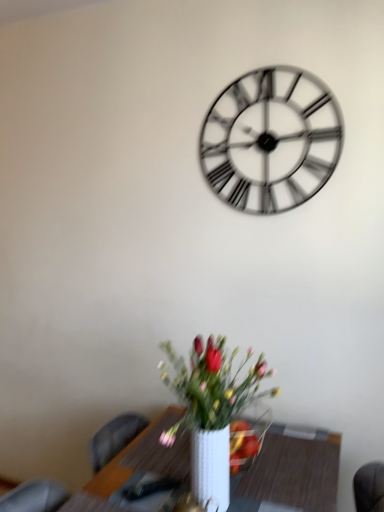
Question: Does metallic silver clock at upper center lie in front of white glossy table at lower center?

Choices:
 (A) no
 (B) yes

Answer: (A)

Question: Is metallic silver clock at upper center turned away from white glossy table at lower center?

Choices:
 (A) yes
 (B) no

Answer: (B)

Question: Is metallic silver clock at upper center to the right of white glossy table at lower center from the viewer's perspective?

Choices:
 (A) no
 (B) yes

Answer: (B)

Question: Is metallic silver clock at upper center placed right next to white glossy table at lower center?

Choices:
 (A) yes
 (B) no

Answer: (B)

Question: From the image's perspective, is metallic silver clock at upper center located above white glossy table at lower center?

Choices:
 (A) yes
 (B) no

Answer: (A)

Question: Is white ceramic vase at lower center wider or thinner than metallic silver clock at upper center?

Choices:
 (A) thin
 (B) wide

Answer: (B)

Question: Is white ceramic vase at lower center in front of or behind metallic silver clock at upper center in the image?

Choices:
 (A) behind
 (B) front

Answer: (B)

Question: Looking at the image, does white ceramic vase at lower center seem bigger or smaller compared to metallic silver clock at upper center?

Choices:
 (A) big
 (B) small

Answer: (A)

Question: Does point (200, 424) appear closer or farther from the camera than point (309, 169)?

Choices:
 (A) farther
 (B) closer

Answer: (B)

Question: Considering the positions of white glossy table at lower center and metallic silver clock at upper center in the image, is white glossy table at lower center bigger or smaller than metallic silver clock at upper center?

Choices:
 (A) small
 (B) big

Answer: (B)

Question: From the image's perspective, is white glossy table at lower center located above or below metallic silver clock at upper center?

Choices:
 (A) below
 (B) above

Answer: (A)

Question: Is point (168, 458) positioned closer to the camera than point (264, 161)?

Choices:
 (A) farther
 (B) closer

Answer: (B)

Question: Looking at their shapes, would you say white glossy table at lower center is wider or thinner than metallic silver clock at upper center?

Choices:
 (A) thin
 (B) wide

Answer: (B)

Question: Looking at the image, does metallic silver clock at upper center seem bigger or smaller compared to white ceramic vase at lower center?

Choices:
 (A) big
 (B) small

Answer: (B)

Question: Considering the relative positions of metallic silver clock at upper center and white ceramic vase at lower center in the image provided, is metallic silver clock at upper center to the left or to the right of white ceramic vase at lower center?

Choices:
 (A) left
 (B) right

Answer: (B)